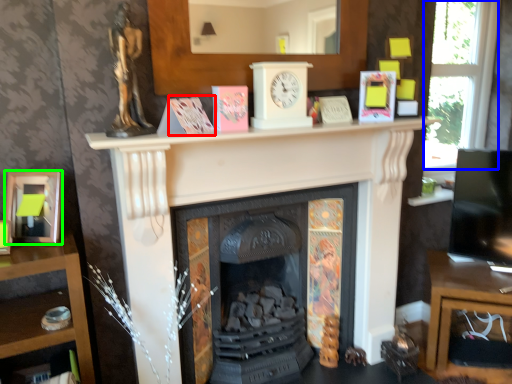
Question: Considering the real-world distances, which object is closest to paperback book (highlighted by a red box)? window (highlighted by a blue box) or picture frame (highlighted by a green box).

Choices:
 (A) window
 (B) picture frame

Answer: (B)